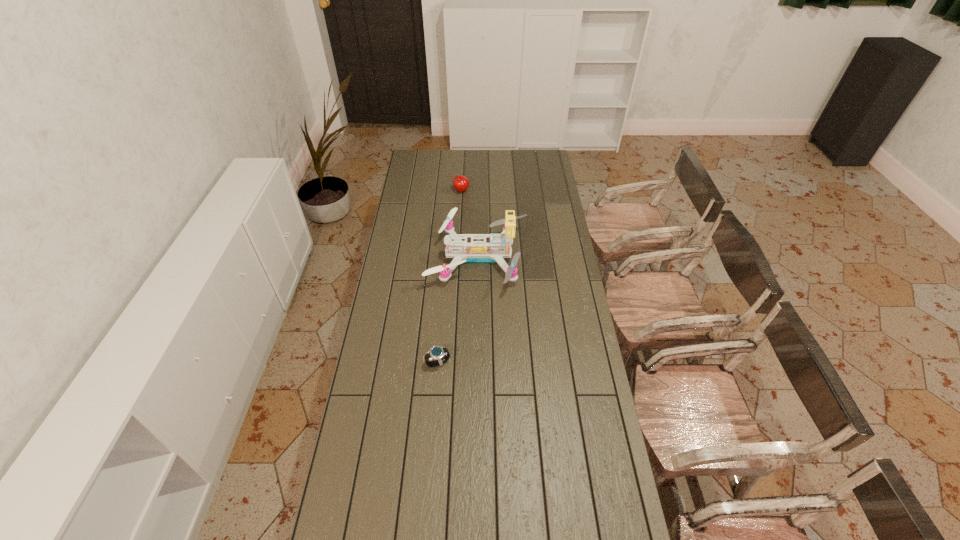
Where is `vacant space at the right edge`? The width and height of the screenshot is (960, 540). vacant space at the right edge is located at coordinates (602, 469).

You are a GUI agent. You are given a task and a screenshot of the screen. Output one action in this format:
    pyautogui.click(x=<x>, y=<y>)
    Task: Click on the free region at the far left corner of the desktop
    The height and width of the screenshot is (540, 960).
    Given the screenshot: What is the action you would take?
    pyautogui.click(x=417, y=154)

The image size is (960, 540). What are the coordinates of `empty space that is in between the drone and the nearest object` in the screenshot? It's located at (458, 310).

Where is `empty space between the tallest object and the cherry`? The height and width of the screenshot is (540, 960). empty space between the tallest object and the cherry is located at coordinates (469, 224).

The image size is (960, 540). I want to click on the second closest object to the tallest object, so click(436, 352).

I want to click on object that can be found as the second closest to the farthest object, so click(436, 352).